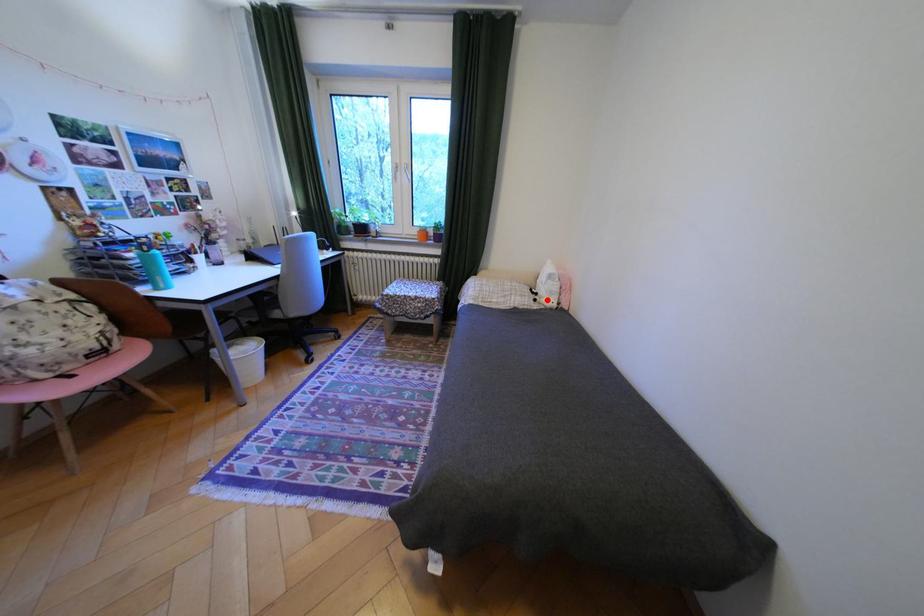
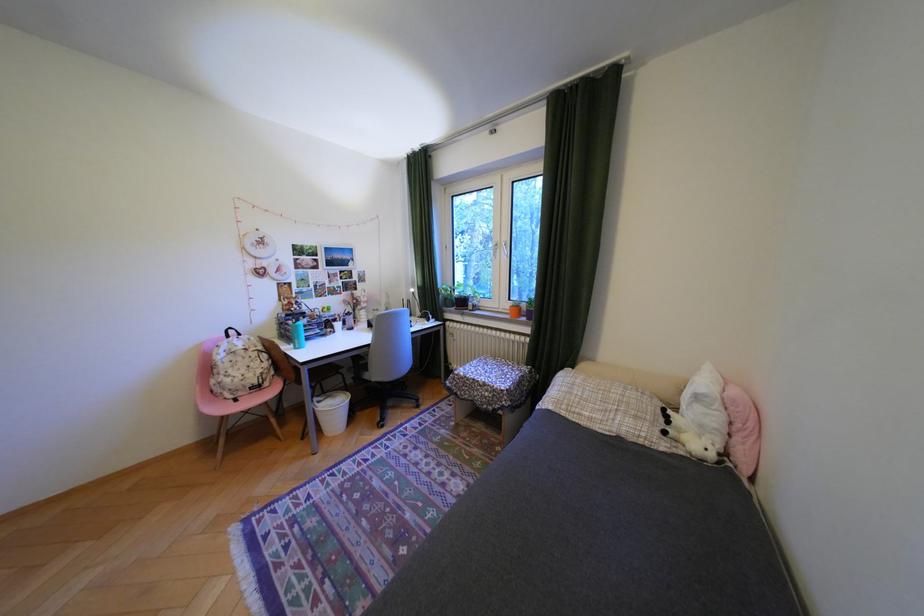
In the second image, find the point that corresponds to the highlighted location in the first image.

(676, 432)